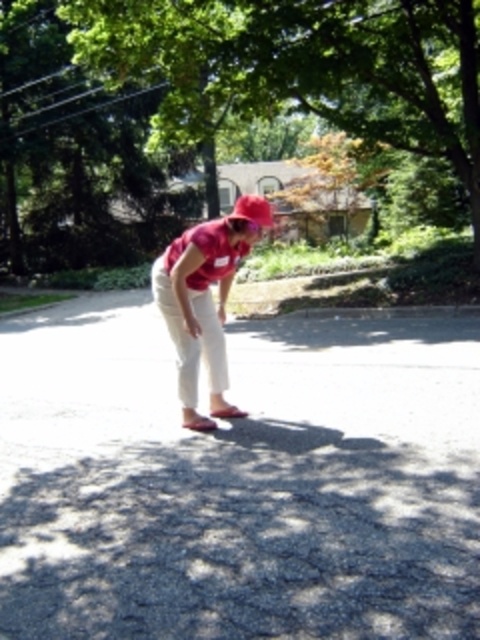
You are standing in the outdoor scene and want to place a small bench between the green leafy tree at upper center and the pink fabric hat at center. Based on their positions, which side of the bench should face the tree?

The bench should face towards the pink fabric hat at center because the green leafy tree at upper center is located to the left of the pink fabric hat at center.

You are a photographer trying to capture a photo of the green leafy tree at upper center and the pink fabric hat at center. Which object should you focus on first if you want to ensure both are in sharp focus, considering their sizes?

Result: The green leafy tree at upper center might be wider than the pink fabric hat at center, so focusing on the larger object first would help ensure both are in focus.